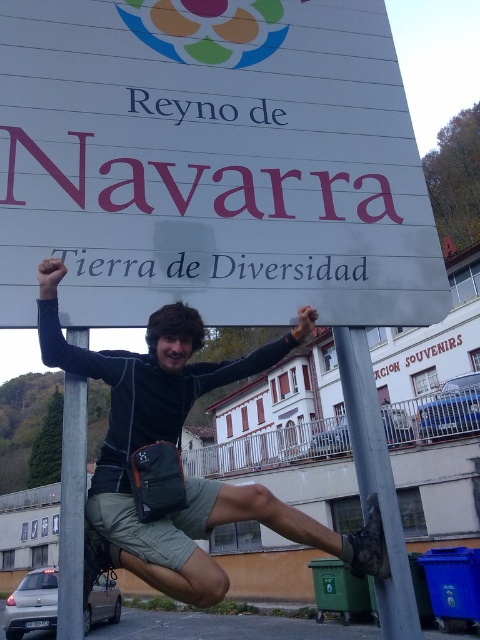
Who is more forward, (128, 556) or (60, 548)?

Point (128, 556) is in front.

Is black fabric backpack at center smaller than metallic pole at left?

Actually, black fabric backpack at center might be larger than metallic pole at left.

Is point (99, 516) behind point (80, 595)?

Yes, it is.

The width and height of the screenshot is (480, 640). In order to click on black fabric backpack at center in this screenshot , I will do `click(175, 449)`.

Is white plastic sign at upper center smaller than metallic pole at lower center?

Incorrect, white plastic sign at upper center is not smaller in size than metallic pole at lower center.

Is point (289, 282) less distant than point (355, 381)?

Yes.

Image resolution: width=480 pixels, height=640 pixels. Find the location of `white plastic sign at upper center`. white plastic sign at upper center is located at coordinates (212, 163).

Does white plastic sign at upper center have a larger size compared to black fabric backpack at center?

Yes.

Between white plastic sign at upper center and black fabric backpack at center, which one is positioned lower?

black fabric backpack at center is lower down.

Locate an element on the screen. The image size is (480, 640). white plastic sign at upper center is located at coordinates (212, 163).

Where is `white plastic sign at upper center`? The image size is (480, 640). white plastic sign at upper center is located at coordinates (212, 163).